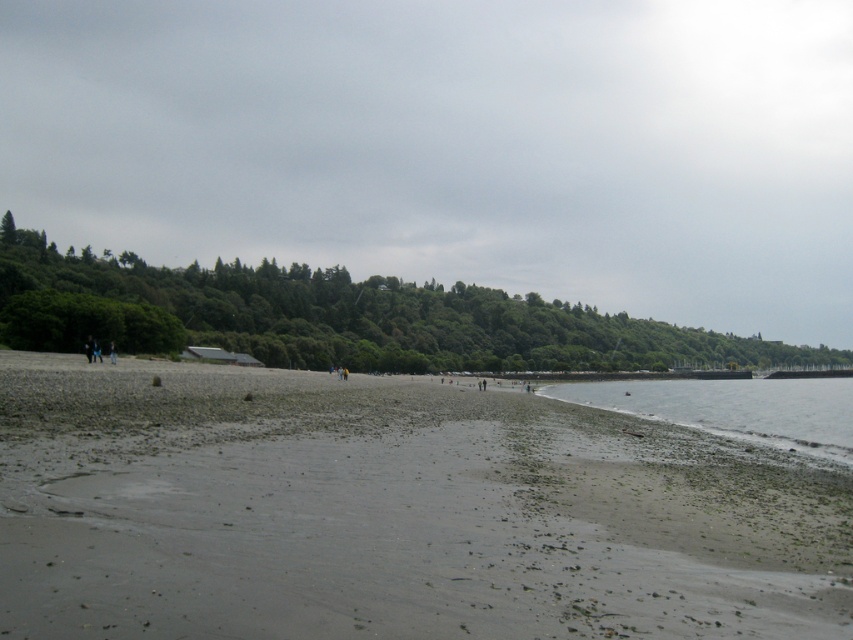
Looking at this image, which is above, green leafy hillside at upper center or clear water at lower right?

green leafy hillside at upper center

Which is more to the left, green leafy hillside at upper center or clear water at lower right?

Positioned to the left is green leafy hillside at upper center.

Locate an element on the screen. green leafy hillside at upper center is located at coordinates (454, 145).

Is green leafy hillside at upper center to the left of smooth sand beach at center from the viewer's perspective?

In fact, green leafy hillside at upper center is to the right of smooth sand beach at center.

What do you see at coordinates (454, 145) in the screenshot?
I see `green leafy hillside at upper center` at bounding box center [454, 145].

Find the location of a particular element. This screenshot has width=853, height=640. green leafy hillside at upper center is located at coordinates (454, 145).

Is the position of smooth sand beach at center more distant than that of clear water at lower right?

No, it is not.

Looking at this image, can you confirm if smooth sand beach at center is positioned below clear water at lower right?

No, smooth sand beach at center is not below clear water at lower right.

Is point (262, 412) more distant than point (683, 406)?

No, (262, 412) is closer to viewer.

Locate an element on the screen. The width and height of the screenshot is (853, 640). smooth sand beach at center is located at coordinates (393, 513).